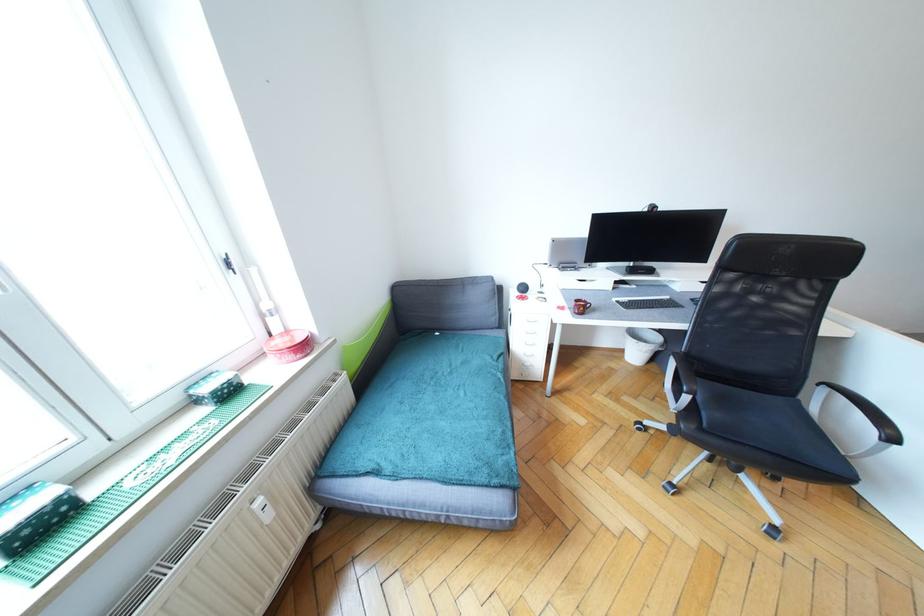
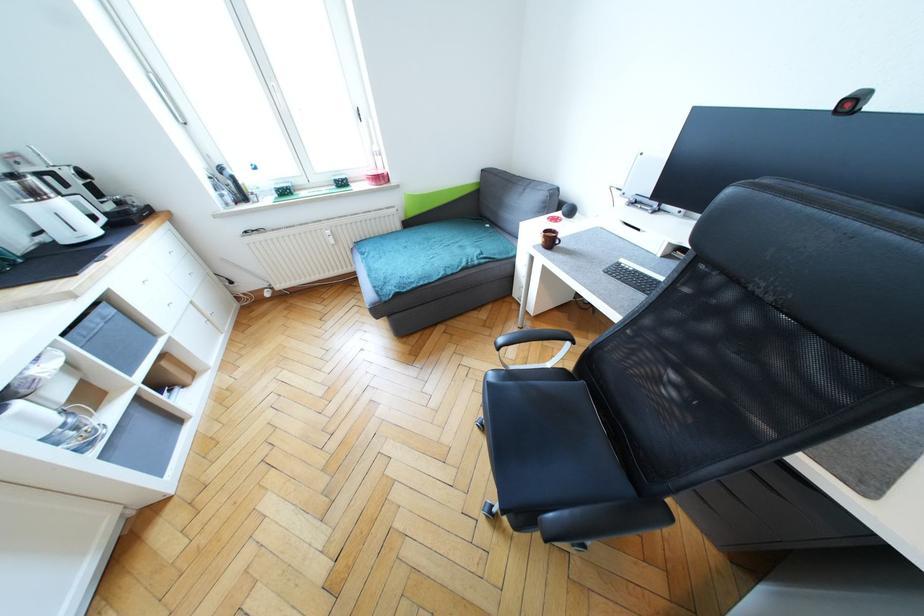
In the second image, find the point that corresponds to point 503,376 in the first image.

(467, 265)